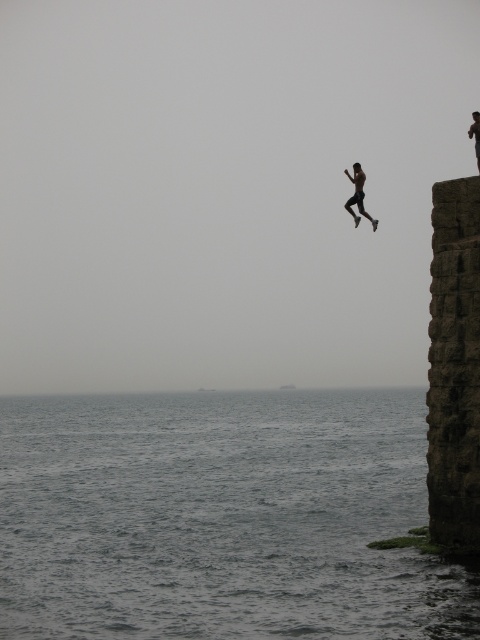
Question: Among these points, which one is farthest from the camera?

Choices:
 (A) (427, 396)
 (B) (356, 184)
 (C) (27, 410)

Answer: (C)

Question: Is gray water at lower left thinner than black matte person at upper right?

Choices:
 (A) yes
 (B) no

Answer: (B)

Question: Is gray water at lower left above dark stone pillar at right?

Choices:
 (A) yes
 (B) no

Answer: (B)

Question: Is dark stone pillar at right positioned behind black matte person at upper right?

Choices:
 (A) no
 (B) yes

Answer: (A)

Question: Which point appears farthest from the camera in this image?

Choices:
 (A) (360, 204)
 (B) (463, 346)
 (C) (60, 424)

Answer: (C)

Question: Which object is the closest to the black matte person at upper right?

Choices:
 (A) gray water at lower left
 (B) dark stone pillar at right

Answer: (B)